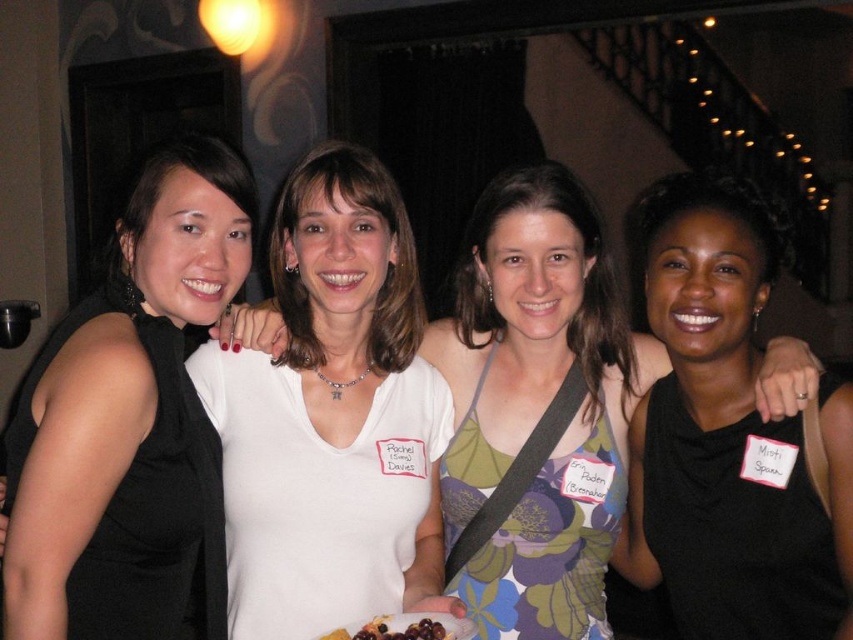
Question: Among these objects, which one is nearest to the camera?

Choices:
 (A) white matte shirt at center
 (B) black satin dress at center

Answer: (B)

Question: Is white matte shirt at center above white matte tank top at center?

Choices:
 (A) no
 (B) yes

Answer: (B)

Question: Which object is positioned closest to the black satin dress at center?

Choices:
 (A) white matte tank top at center
 (B) black sleeveless dress at left
 (C) smooth chocolate cake with berries at center
 (D) white matte shirt at center

Answer: (A)

Question: Is white matte tank top at center smaller than smooth chocolate cake with berries at center?

Choices:
 (A) no
 (B) yes

Answer: (A)

Question: Does white matte tank top at center have a greater width compared to smooth chocolate cake with berries at center?

Choices:
 (A) yes
 (B) no

Answer: (A)

Question: Which object is positioned closest to the white matte tank top at center?

Choices:
 (A) white matte shirt at center
 (B) black satin dress at center

Answer: (B)